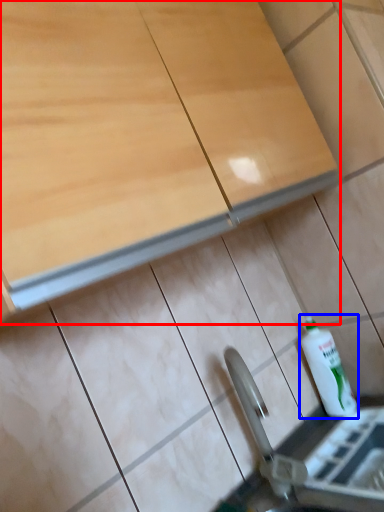
Question: Which object appears farthest to the camera in this image, cabinetry (highlighted by a red box) or bottle (highlighted by a blue box)?

Choices:
 (A) cabinetry
 (B) bottle

Answer: (B)